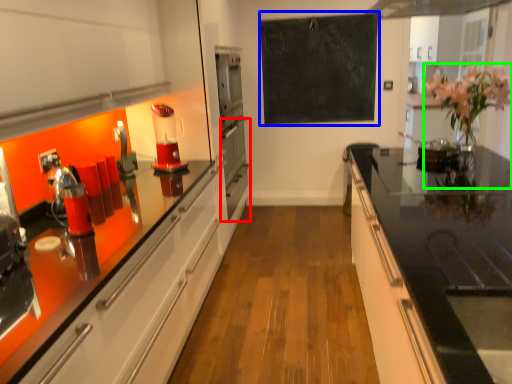
Question: Which is farther away from oven (highlighted by a red box)? bulletin board (highlighted by a blue box) or floral arrangement (highlighted by a green box)?

Choices:
 (A) bulletin board
 (B) floral arrangement

Answer: (B)